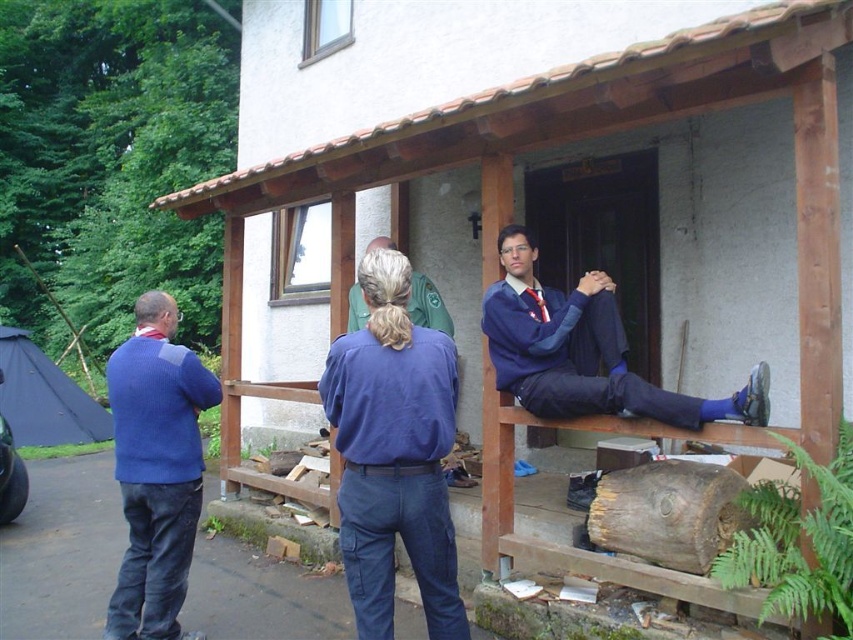
From the picture: You are standing at the point labeled point (x=399, y=321) and want to take a photo of the entire porch and the people on it. If your camera has a maximum focus range of 2.5 meters, will you be able to capture the entire scene clearly?

The distance between point (x=399, y=321) and the camera is 2.31 meters, which is within the camera maximum focus range of 2.5 meters. Therefore, you can capture the entire scene clearly.

You are a photographer trying to capture a group photo of the people on the porch. You want to ensure that both the blue cotton shirt at center and the green fabric jacket at center are clearly visible in the frame. Based on their positions, which one should you focus on to make sure it appears in front?

The blue cotton shirt at center is in front of the green fabric jacket at center, so focusing on the blue cotton shirt at center will ensure it appears in front in the photo.

You are organizing a clothing donation drive and need to categorize the items by size. You have two items to assess in the image provided. Which item is narrower between the blue cotton shirt at center and the blue knitted sweater at left?

The blue cotton shirt at center is narrower than the blue knitted sweater at left.